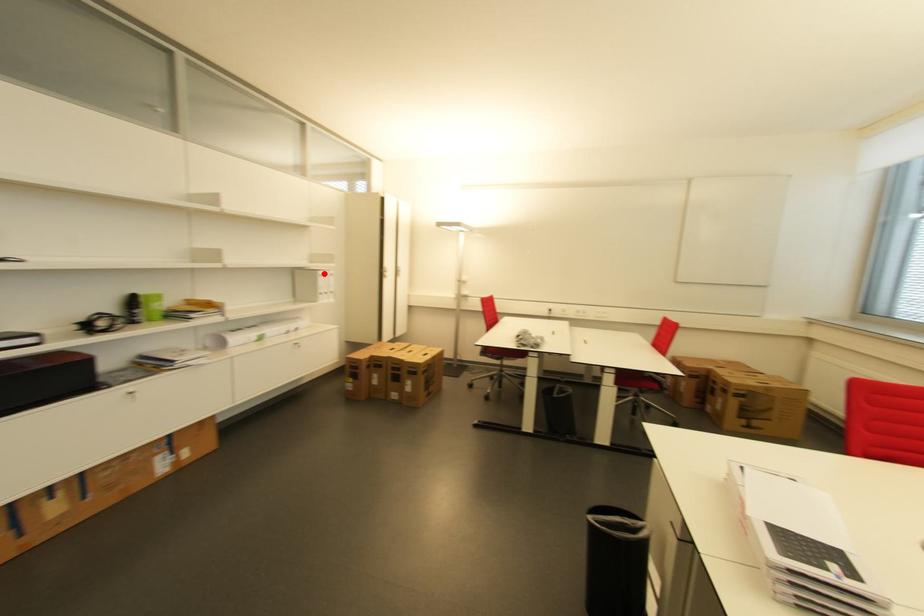
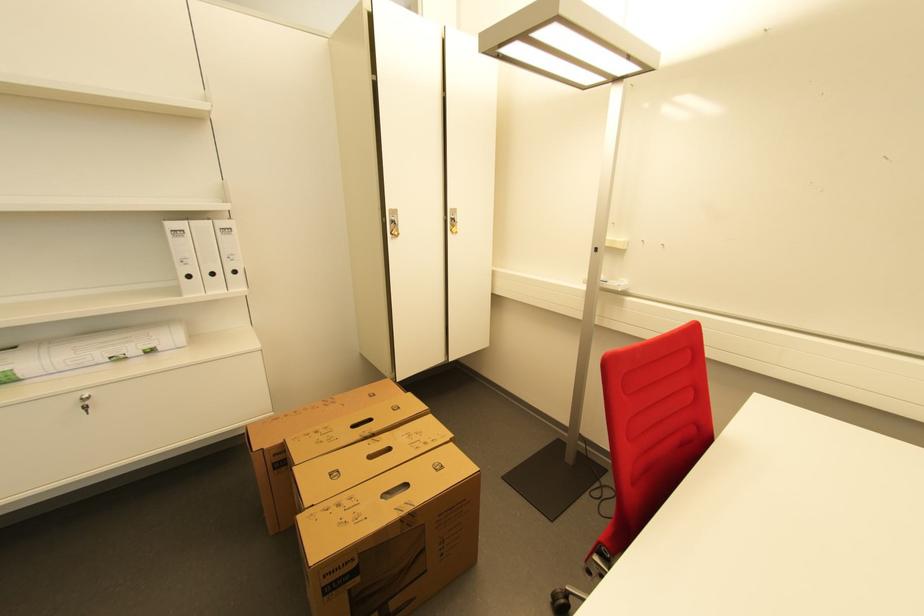
Where in the second image is the point corresponding to the highlighted location from the first image?

(176, 225)